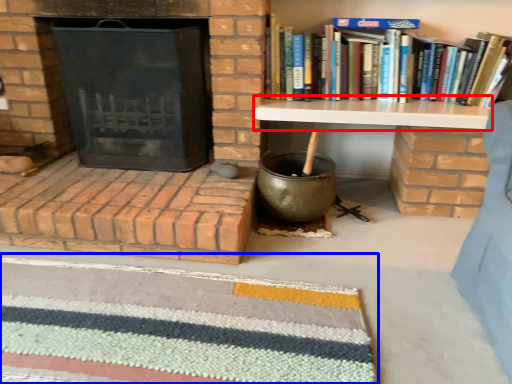
Question: Which object appears closest to the camera in this image, table (highlighted by a red box) or doormat (highlighted by a blue box)?

Choices:
 (A) table
 (B) doormat

Answer: (B)